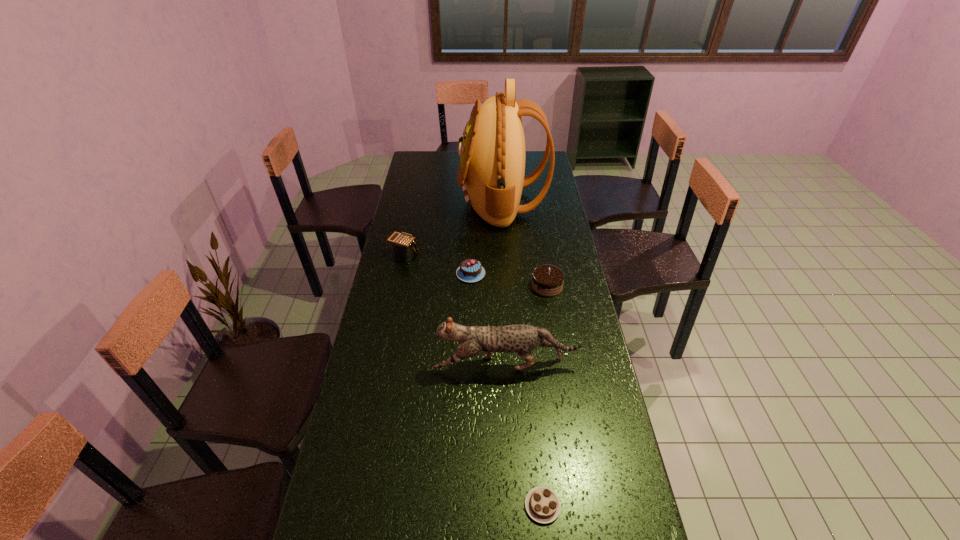
At what (x,y) coordinates should I click in order to perform the action: click on free spot that satisfies the following two spatial constraints: 1. on the front-facing side of the backpack; 2. on the back side of the nearest chocolate cake. Please return your answer as a coordinate pair (x, y). Image resolution: width=960 pixels, height=540 pixels. Looking at the image, I should click on (523, 506).

You are a GUI agent. You are given a task and a screenshot of the screen. Output one action in this format:
    pyautogui.click(x=<x>, y=<y>)
    Task: Click on the free space that satisfies the following two spatial constraints: 1. on the face of the fifth farthest object; 2. on the right side of the shortest chocolate cake
    This screenshot has height=540, width=960.
    Given the screenshot: What is the action you would take?
    pyautogui.click(x=514, y=506)

What are the coordinates of `vacant area that satisfies the following two spatial constraints: 1. on the back side of the tallest chocolate cake; 2. on the front-facing side of the backpack` in the screenshot? It's located at (534, 202).

Identify the location of free spot that satisfies the following two spatial constraints: 1. on the front-facing side of the backpack; 2. on the back side of the tallest chocolate cake. (508, 286).